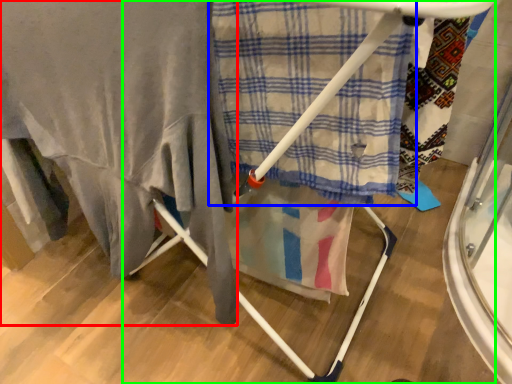
Question: Which is farther away from blanket (highlighted by a red box)? cloth (highlighted by a blue box) or furniture (highlighted by a green box)?

Choices:
 (A) cloth
 (B) furniture

Answer: (B)